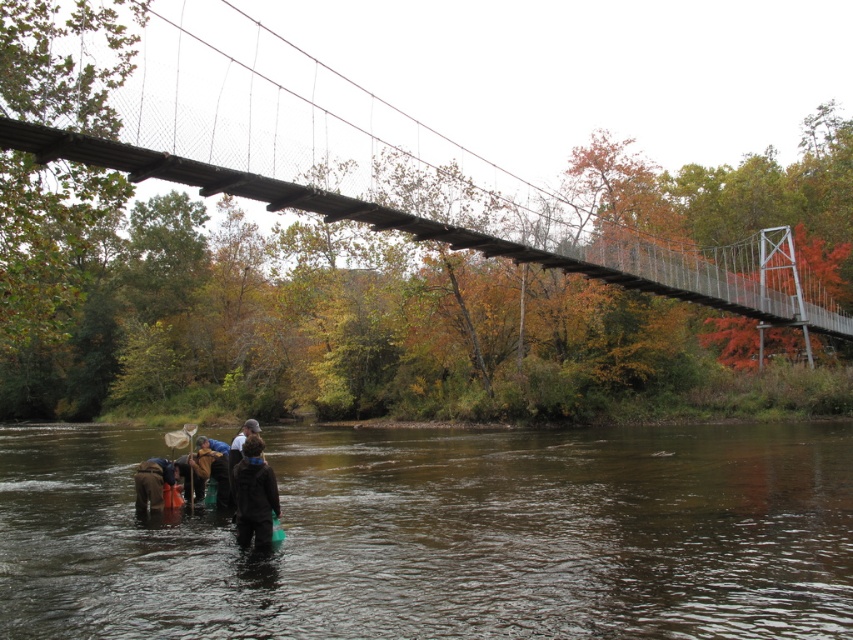
Question: From the image, what is the correct spatial relationship of dark brown jacket at lower center in relation to brown fabric at lower left?

Choices:
 (A) left
 (B) right

Answer: (B)

Question: Is brown murky water at lower center to the right of brown fabric at lower left from the viewer's perspective?

Choices:
 (A) no
 (B) yes

Answer: (B)

Question: Which of the following is the farthest from the observer?

Choices:
 (A) brown fabric at lower left
 (B) brown murky water at lower center

Answer: (A)

Question: Which point is closer to the camera taking this photo?

Choices:
 (A) (242, 468)
 (B) (160, 502)

Answer: (A)

Question: Which point is farther to the camera?

Choices:
 (A) dark brown leather boots at lower left
 (B) brown murky water at lower center
 (C) wooden planks bridge at upper center
 (D) brown fabric at lower left

Answer: (D)

Question: Can you confirm if brown murky water at lower center is positioned above dark brown leather boots at lower left?

Choices:
 (A) yes
 (B) no

Answer: (B)